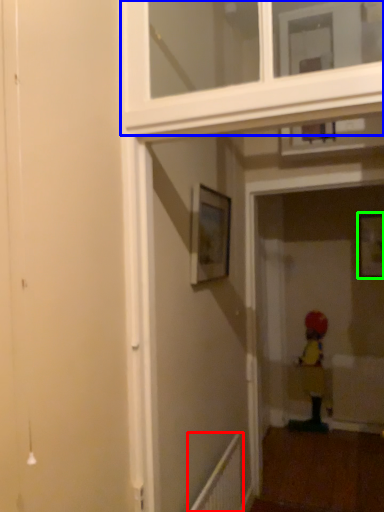
Question: Based on their relative distances, which object is farther from radiator (highlighted by a red box)? Choose from window frame (highlighted by a blue box) and picture frame (highlighted by a green box).

Choices:
 (A) window frame
 (B) picture frame

Answer: (B)